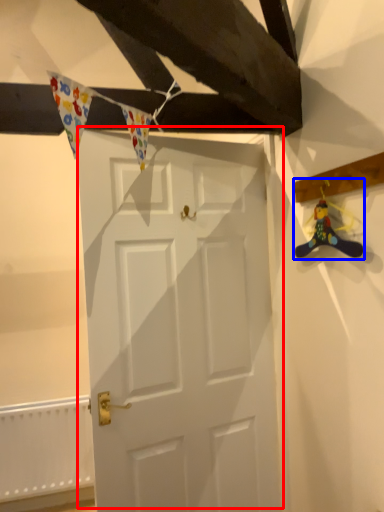
Question: Which of the following is the closest to the observer, door (highlighted by a red box) or miniature (highlighted by a blue box)?

Choices:
 (A) door
 (B) miniature

Answer: (B)